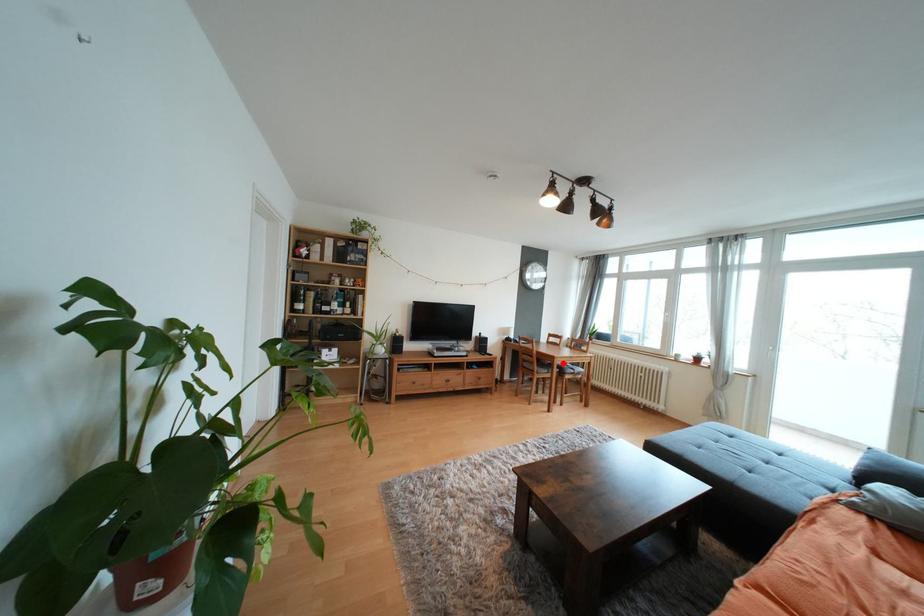
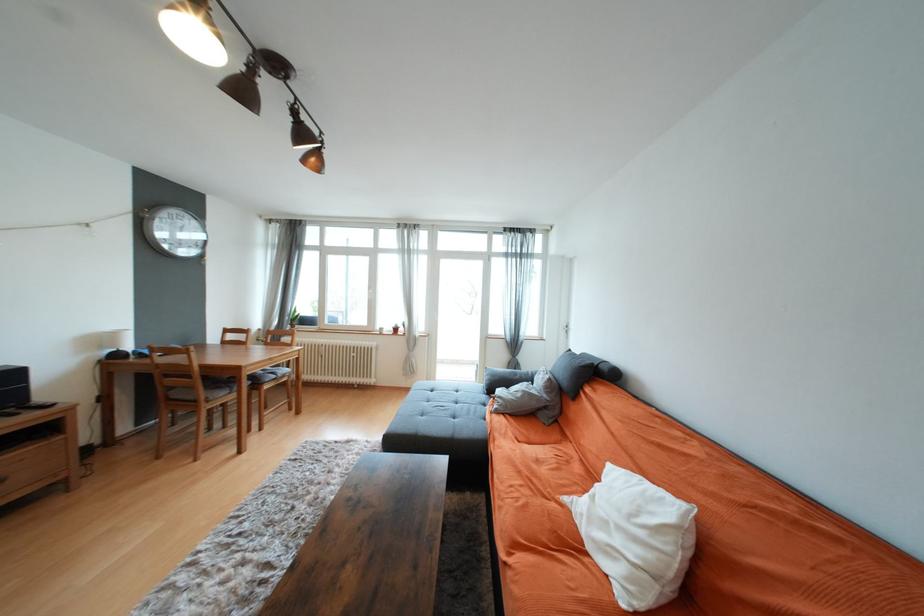
Question: I am providing you with two images of the same scene from different viewpoints. Given a red point in image1, look at the same physical point in image2. Is it:

Choices:
 (A) Closer to the viewpoint
 (B) Farther from the viewpoint

Answer: (A)